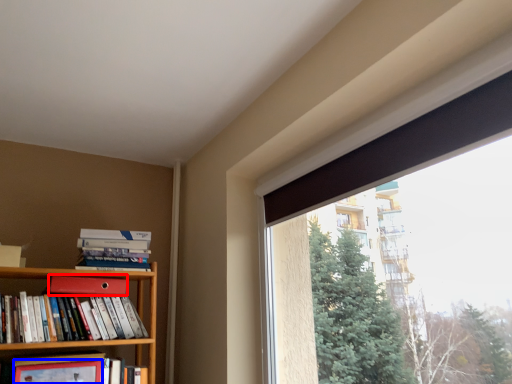
Question: Which of the following is the farthest to the observer, paperback book (highlighted by a red box) or paperback book (highlighted by a blue box)?

Choices:
 (A) paperback book
 (B) paperback book

Answer: (A)